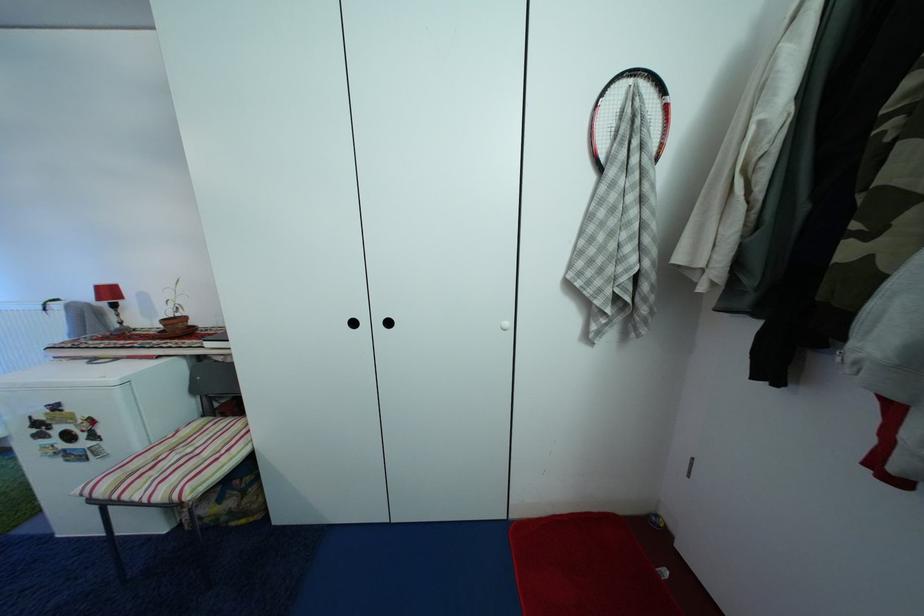
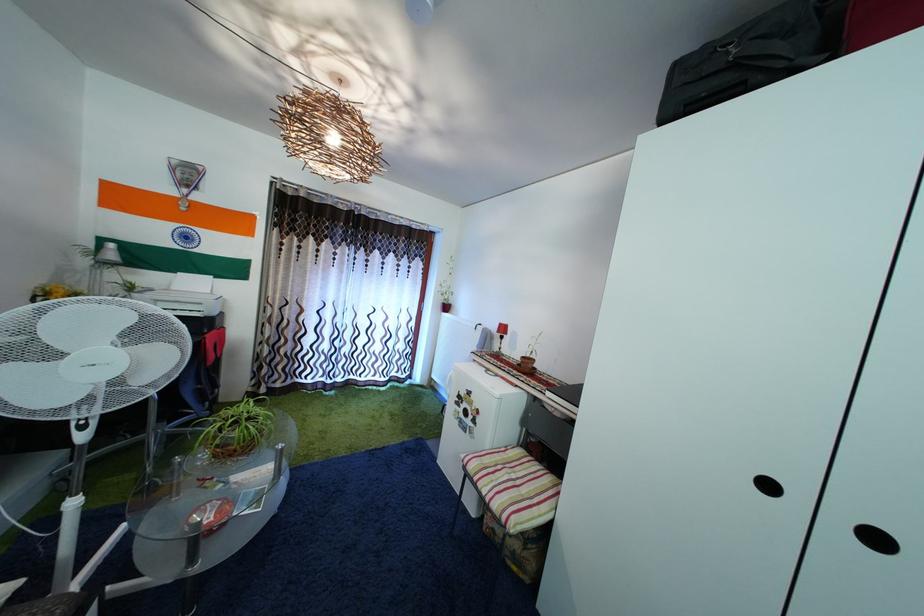
The point at (198, 456) is marked in the first image. Where is the corresponding point in the second image?

(521, 484)